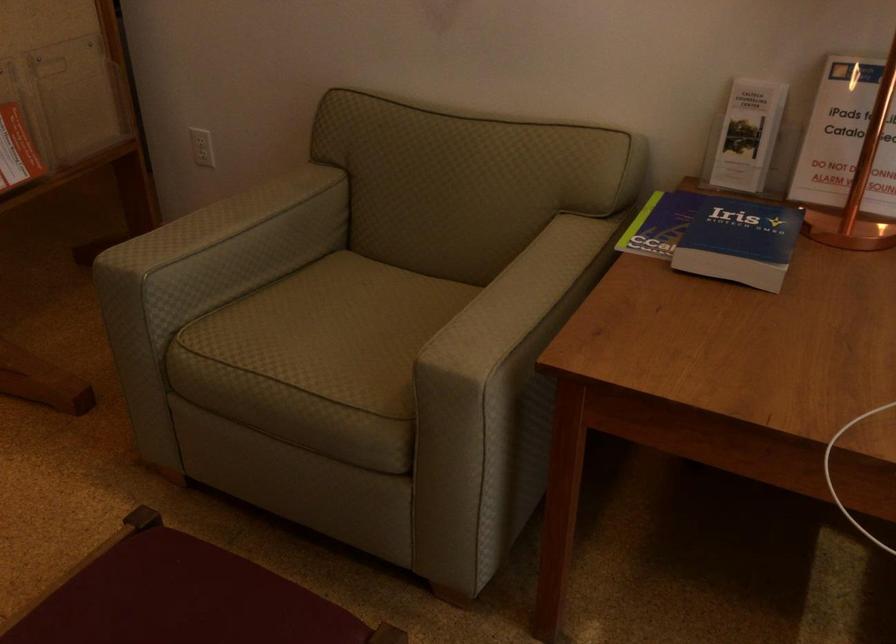
Find where to lift the blue 'Iris' book. Please return your answer as a coordinate pair (x, y).

(739, 242)